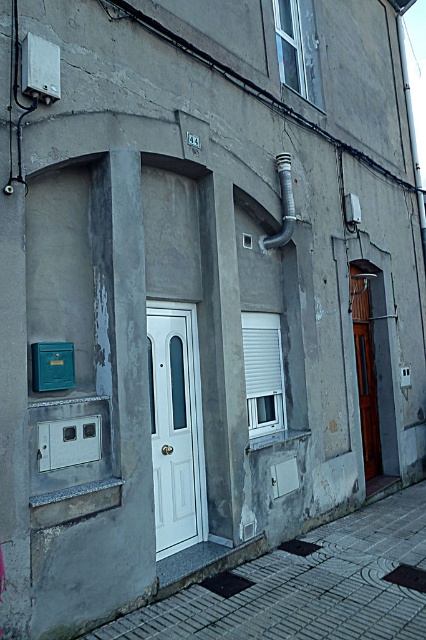
Question: Which point appears closest to the camera in this image?

Choices:
 (A) (141, 632)
 (B) (189, 536)
 (C) (215, 241)

Answer: (A)

Question: Among these objects, which one is farthest from the camera?

Choices:
 (A) white glossy door at center
 (B) green plastic mailbox at lower left
 (C) metallic gray mailbox at lower left

Answer: (A)

Question: Which object appears farthest from the camera in this image?

Choices:
 (A) metallic gray mailbox at lower left
 (B) gray concrete pillar at center
 (C) brick pavement at center

Answer: (B)

Question: Can you confirm if brick pavement at center is smaller than gray concrete pillar at center?

Choices:
 (A) no
 (B) yes

Answer: (A)

Question: Is metallic gray mailbox at lower left above green plastic mailbox at lower left?

Choices:
 (A) yes
 (B) no

Answer: (B)

Question: Is brick pavement at center to the left of gray concrete pillar at center from the viewer's perspective?

Choices:
 (A) yes
 (B) no

Answer: (B)